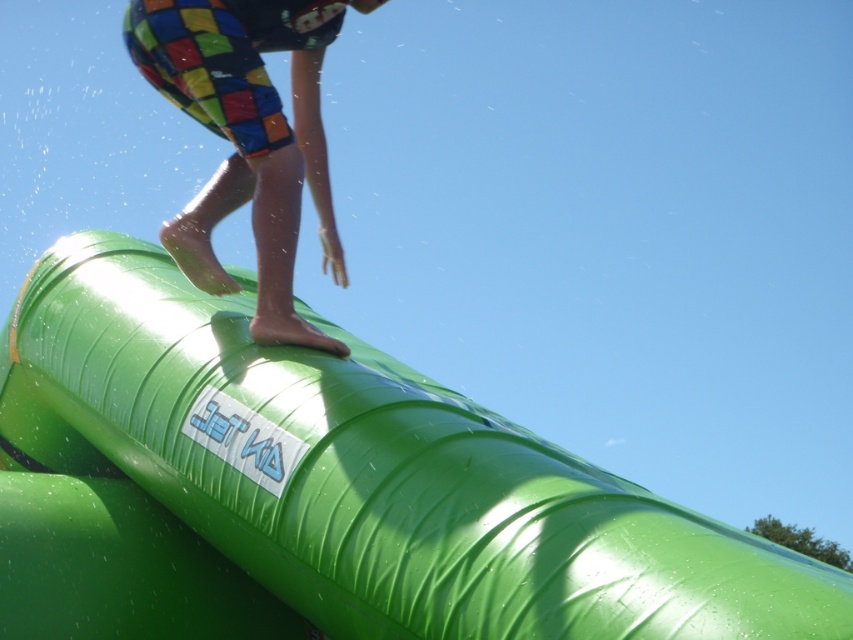
Does green rubber slide at upper center have a smaller size compared to multicolored shorts at upper center?

No, green rubber slide at upper center is not smaller than multicolored shorts at upper center.

Measure the distance between green rubber slide at upper center and multicolored shorts at upper center.

They are 32.84 inches apart.

Find the location of a particular element. green rubber slide at upper center is located at coordinates (322, 490).